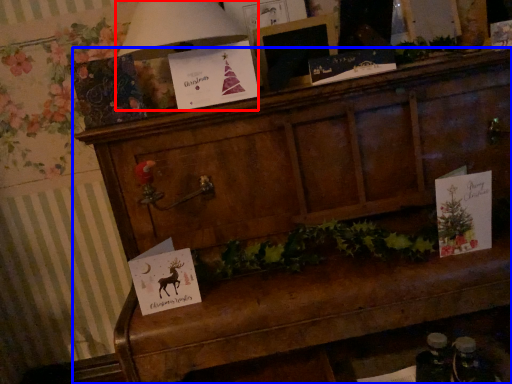
Question: Which object appears closest to the camera in this image, lamp (highlighted by a red box) or furniture (highlighted by a blue box)?

Choices:
 (A) lamp
 (B) furniture

Answer: (B)